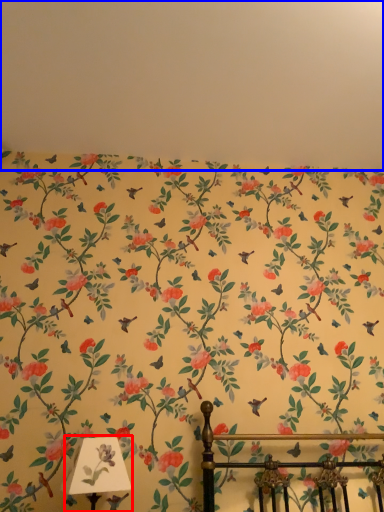
Question: Which of the following is the farthest to the observer, table lamp (highlighted by a red box) or backdrop (highlighted by a blue box)?

Choices:
 (A) table lamp
 (B) backdrop

Answer: (B)